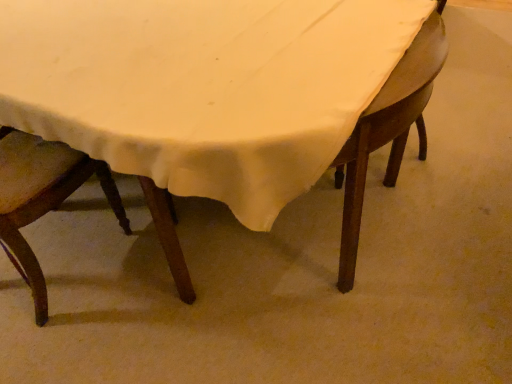
I want to click on wooden chair at center, so click(388, 131).

This screenshot has width=512, height=384. What do you see at coordinates (388, 131) in the screenshot? I see `wooden chair at center` at bounding box center [388, 131].

Find the location of a particular element. wooden chair at center is located at coordinates (388, 131).